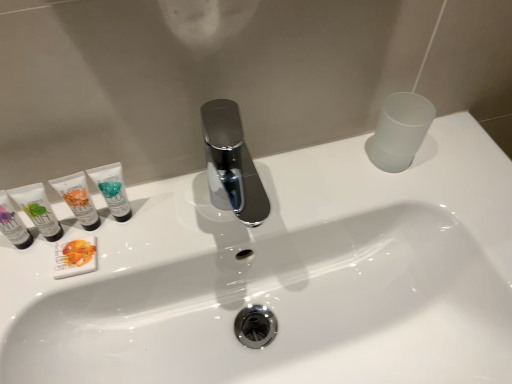
Locate an element on the screen. This screenshot has width=512, height=384. free location to the right of matte white tube at left, the fifth toiletry in the right-to-left sequence is located at coordinates (155, 232).